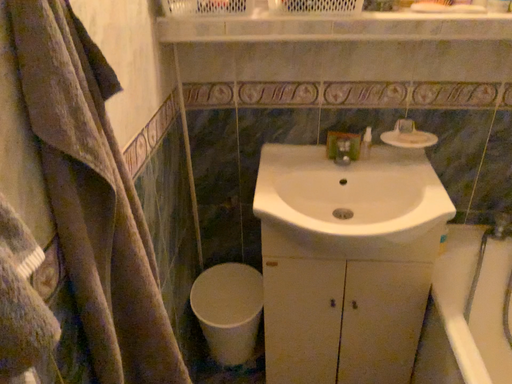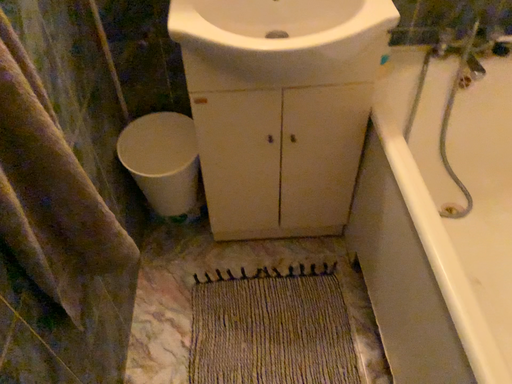
Question: How did the camera likely rotate when shooting the video?

Choices:
 (A) rotated right
 (B) rotated left

Answer: (A)